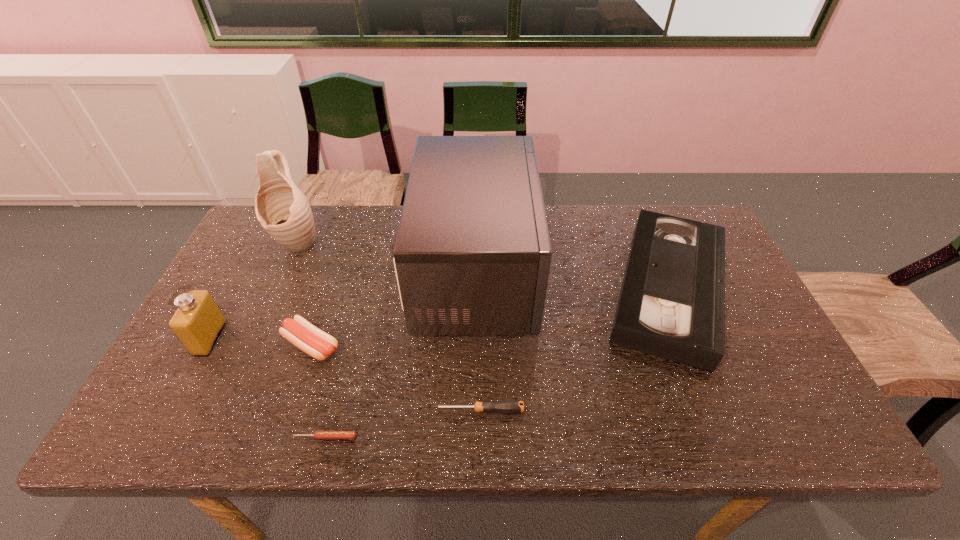
At what (x,y) coordinates should I click in order to perform the action: click on pitcher. Please return your answer as a coordinate pair (x, y). This screenshot has height=540, width=960. Looking at the image, I should click on (282, 209).

I want to click on microwave oven, so [472, 256].

Identify the location of perfume. (198, 322).

You are a GUI agent. You are given a task and a screenshot of the screen. Output one action in this format:
    pyautogui.click(x=<x>, y=<y>)
    Task: Click on the leftmost object
    
    Given the screenshot: What is the action you would take?
    pyautogui.click(x=198, y=322)

Locate an element on the screen. the rightmost object is located at coordinates (672, 301).

This screenshot has height=540, width=960. What are the coordinates of `the fourth tallest object` in the screenshot? It's located at (672, 301).

This screenshot has width=960, height=540. In order to click on the taller sausage in this screenshot , I will do `click(318, 344)`.

Image resolution: width=960 pixels, height=540 pixels. Identify the location of the fifth tallest object. (318, 344).

Find the location of a particular element. The width and height of the screenshot is (960, 540). screwdriver is located at coordinates (508, 406).

This screenshot has height=540, width=960. In order to click on the second nearest object in this screenshot , I will do `click(508, 406)`.